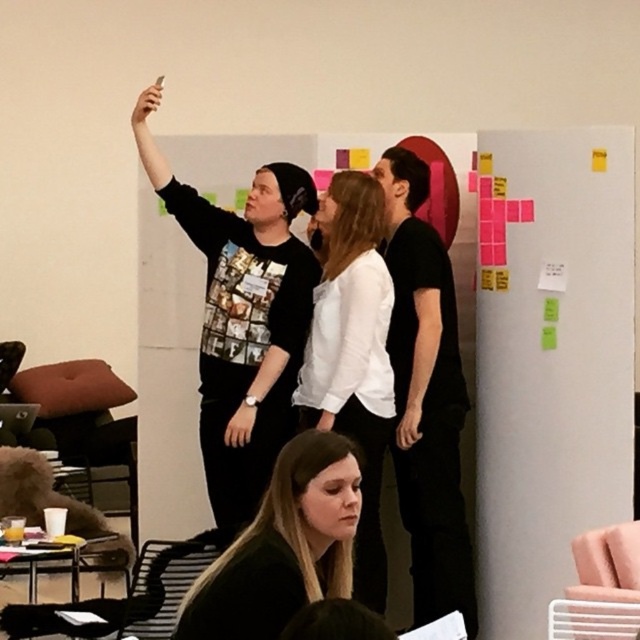
You are organizing a clothing donation drive and need to sort items based on their placement. According to the scene, which item is located above the other between the black matte sweatshirt at upper left and the black matte shirt at lower center?

The black matte sweatshirt at upper left is positioned over the black matte shirt at lower center, meaning it is above the other.

You are a photographer trying to capture a clear photo of the white matte shirt at center and the black matte shirt at lower center. Which one will appear larger in the photo?

The white matte shirt at center will appear larger in the photo because it is closer to the viewer than the black matte shirt at lower center.

You are a photographer trying to capture a group photo of the black matte shirt at center and white matte shirt at center. The camera you have can only focus on objects within a 12 inch range. Based on the scene description, will both subjects be in focus?

The black matte shirt at center and white matte shirt at center are 14.06 inches apart. Since the camera can only focus within a 12 inch range, the distance between them exceeds the focus range, so both subjects may not be in focus simultaneously.